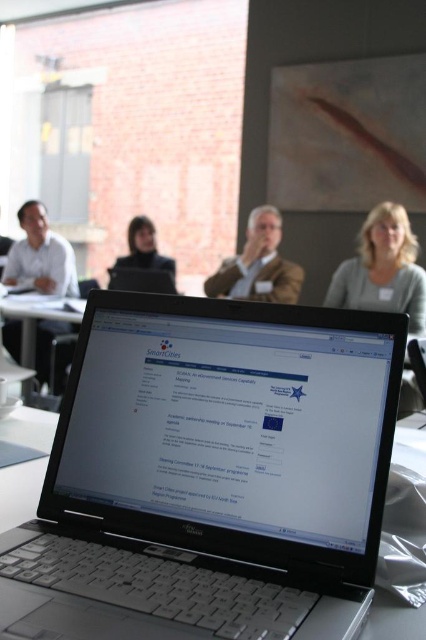
You are standing in the conference room and want to move from the laptop to the table where the person in white shirt is sitting. The laptop is located at point (17, 257) and the table is at point (157, 253). Which direction should you move to get closer to the table?

You should move away from the viewer since point (17, 257) is closer to the viewer than point (157, 253) according to the coordinates provided.

You are attending a meeting in the conference room and notice two people in the background. One is wearing a light gray sweater at upper right and the other a matte white shirt at left. From your perspective, which person is sitting on the right side?

The light gray sweater at upper right is to the right of matte white shirt at left, so the person wearing the light gray sweater at upper right is sitting on the right side.

You are organizing a presentation in the conference room and need to ensure that all participants can see the laptop screen. Considering the positions of the matte white shirt at left and the matte black laptop at center, which object is taller and might obstruct the view of the laptop screen?

The matte white shirt at left is taller than the matte black laptop at center, so it might obstruct the view of the laptop screen.